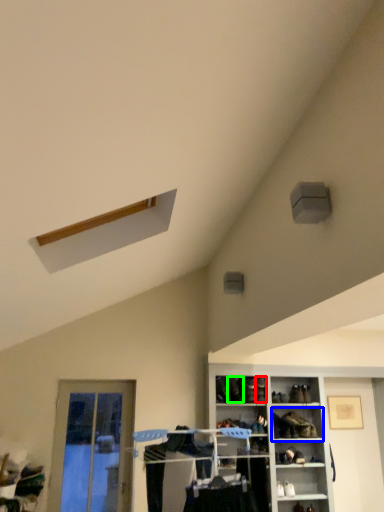
Question: Which object is the closest to the shoe (highlighted by a red box)? Choose among these: shelf (highlighted by a blue box) or shoe (highlighted by a green box).

Choices:
 (A) shelf
 (B) shoe

Answer: (B)